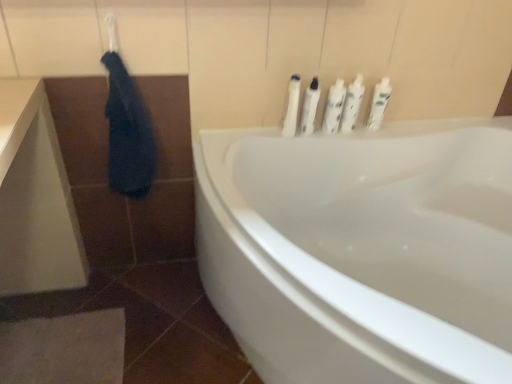
Question: Is white glossy bottles at upper right, the fifth toiletry from the left, wider than white glossy bottles at upper center, arranged as the fourth toiletry when viewed from the right?

Choices:
 (A) yes
 (B) no

Answer: (A)

Question: Is white glossy bottles at upper right, the first toiletry viewed from the right, looking in the opposite direction of white glossy bottles at upper center, arranged as the second toiletry when viewed from the left?

Choices:
 (A) yes
 (B) no

Answer: (B)

Question: Does white glossy bottles at upper right, the fifth toiletry from the left, have a larger size compared to white glossy bottles at upper center, arranged as the second toiletry when viewed from the left?

Choices:
 (A) yes
 (B) no

Answer: (A)

Question: Is white glossy bottles at upper right, the first toiletry viewed from the right, taller than white glossy bottles at upper center, arranged as the second toiletry when viewed from the left?

Choices:
 (A) yes
 (B) no

Answer: (B)

Question: Is white glossy bottles at upper right, the first toiletry viewed from the right, smaller than white glossy bottles at upper center, arranged as the fourth toiletry when viewed from the right?

Choices:
 (A) yes
 (B) no

Answer: (B)

Question: From the image's perspective, relative to white plastic bottles at upper right, the 1th toiletry viewed from the left, is white glossy bottles at upper center, arranged as the second toiletry when viewed from the left, above or below?

Choices:
 (A) below
 (B) above

Answer: (B)

Question: Relative to white plastic bottles at upper right, the fifth toiletry in the right-to-left sequence, is white glossy bottles at upper center, arranged as the second toiletry when viewed from the left, in front or behind?

Choices:
 (A) front
 (B) behind

Answer: (B)

Question: Considering the positions of white glossy bottles at upper center, arranged as the fourth toiletry when viewed from the right, and white plastic bottles at upper right, the 1th toiletry viewed from the left, in the image, is white glossy bottles at upper center, arranged as the fourth toiletry when viewed from the right, taller or shorter than white plastic bottles at upper right, the 1th toiletry viewed from the left,?

Choices:
 (A) short
 (B) tall

Answer: (A)

Question: Visually, is white glossy bottles at upper center, arranged as the fourth toiletry when viewed from the right, positioned to the left or to the right of white plastic bottles at upper right, the fifth toiletry in the right-to-left sequence?

Choices:
 (A) left
 (B) right

Answer: (B)

Question: Do you think white glossy bottles at upper right, the fifth toiletry from the left, is within dark blue fabric at upper left, or outside of it?

Choices:
 (A) inside
 (B) outside

Answer: (B)

Question: Would you say white glossy bottles at upper right, the first toiletry viewed from the right, is to the left or to the right of dark blue fabric at upper left in the picture?

Choices:
 (A) left
 (B) right

Answer: (B)

Question: Considering the positions of white glossy bottles at upper right, the fifth toiletry from the left, and dark blue fabric at upper left in the image, is white glossy bottles at upper right, the fifth toiletry from the left, wider or thinner than dark blue fabric at upper left?

Choices:
 (A) thin
 (B) wide

Answer: (A)

Question: In terms of size, does white glossy bottles at upper right, the first toiletry viewed from the right, appear bigger or smaller than dark blue fabric at upper left?

Choices:
 (A) big
 (B) small

Answer: (B)

Question: Looking at the image, does white plastic bottles at upper center, which is the third toiletry in left-to-right order, seem bigger or smaller compared to dark blue fabric at upper left?

Choices:
 (A) small
 (B) big

Answer: (A)

Question: Choose the correct answer: Is white plastic bottles at upper center, which is the third toiletry in left-to-right order, inside dark blue fabric at upper left or outside it?

Choices:
 (A) outside
 (B) inside

Answer: (A)